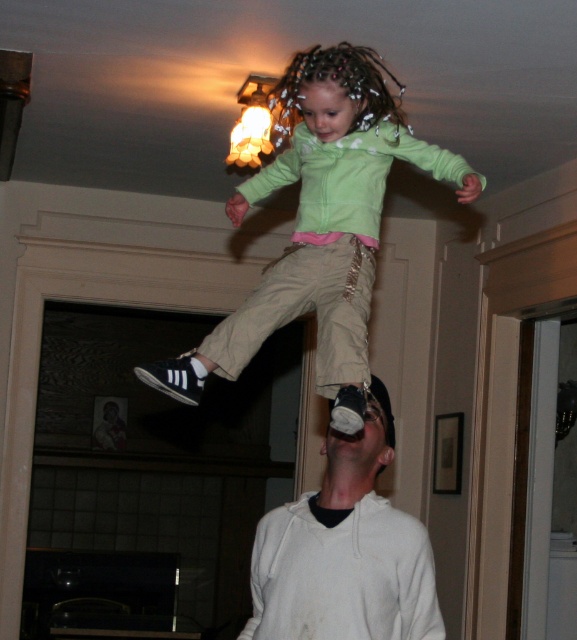
Can you confirm if green matte hoodie at upper center is taller than white cotton hoodie at lower center?

Correct, green matte hoodie at upper center is much taller as white cotton hoodie at lower center.

Does green matte hoodie at upper center appear over white cotton hoodie at lower center?

Yes, green matte hoodie at upper center is above white cotton hoodie at lower center.

Is point (230, 332) positioned behind point (432, 632)?

Yes, point (230, 332) is behind point (432, 632).

Find the location of `green matte hoodie at upper center`. green matte hoodie at upper center is located at coordinates (320, 227).